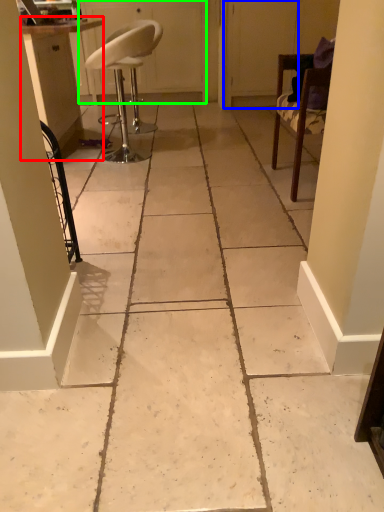
Question: Which object is positioned closest to cabinetry (highlighted by a red box)? Select from screen door (highlighted by a blue box) and screen door (highlighted by a green box).

Choices:
 (A) screen door
 (B) screen door

Answer: (B)